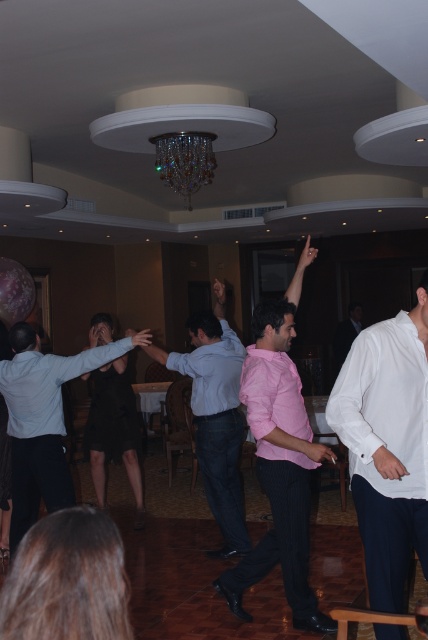
Question: Is white cotton shirt at right to the right of pink satin shirt at center from the viewer's perspective?

Choices:
 (A) no
 (B) yes

Answer: (A)

Question: Which is farther from the white cotton shirt at right?

Choices:
 (A) crystal glass chandelier at center
 (B) pink matte shirt at center

Answer: (A)

Question: Which object is the farthest from the pink satin shirt at center?

Choices:
 (A) crystal glass chandelier at center
 (B) pink matte shirt at center
 (C) pink pinstripe shirt at center

Answer: (C)

Question: Is matte white shirt at center positioned at the back of pink matte shirt at center?

Choices:
 (A) no
 (B) yes

Answer: (A)

Question: Which object is positioned farthest from the matte white shirt at center?

Choices:
 (A) crystal glass chandelier at center
 (B) pink matte shirt at center
 (C) pink pinstripe shirt at center
 (D) pink satin shirt at center

Answer: (D)

Question: Can you confirm if pink matte shirt at center is positioned to the right of crystal glass chandelier at center?

Choices:
 (A) no
 (B) yes

Answer: (B)